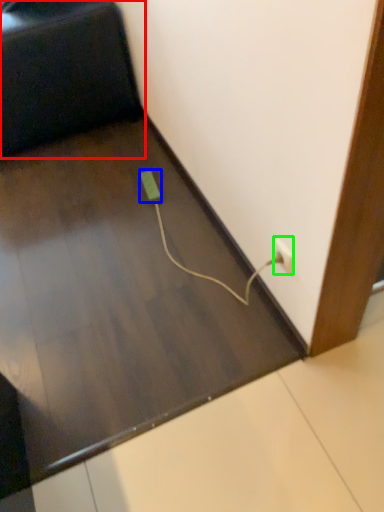
Question: Which object is the closest to the furniture (highlighted by a red box)? Choose among these: socket (highlighted by a blue box) or power plugs and sockets (highlighted by a green box).

Choices:
 (A) socket
 (B) power plugs and sockets

Answer: (A)